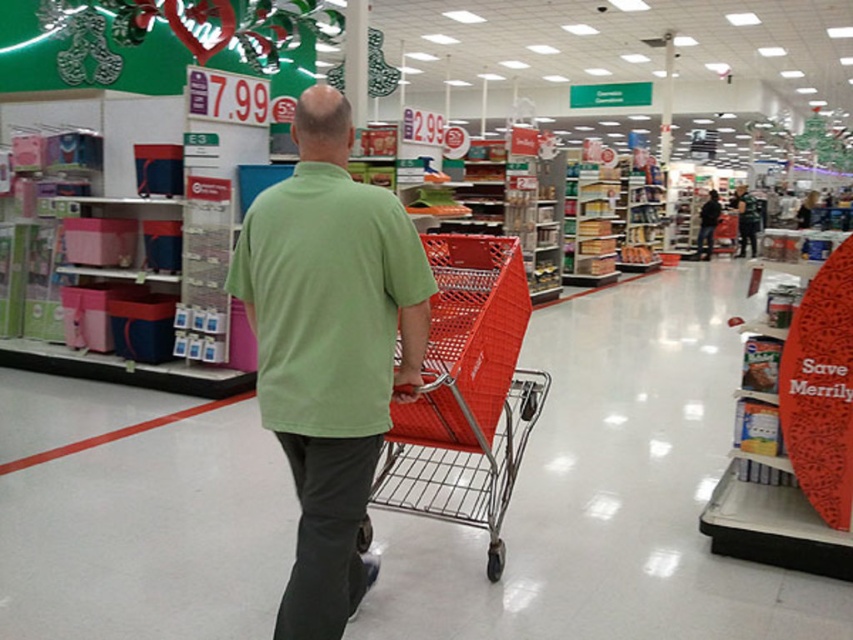
Question: Is green matte shirt at center behind metallic red shopping cart at center?

Choices:
 (A) no
 (B) yes

Answer: (A)

Question: Which object appears closest to the camera in this image?

Choices:
 (A) green matte shirt at center
 (B) metallic red shopping cart at center

Answer: (A)

Question: Does green matte shirt at center appear on the left side of metallic red shopping cart at center?

Choices:
 (A) yes
 (B) no

Answer: (A)

Question: Where is green matte shirt at center located in relation to metallic red shopping cart at center in the image?

Choices:
 (A) above
 (B) below

Answer: (A)

Question: Which point is closer to the camera?

Choices:
 (A) green matte shirt at center
 (B) metallic red shopping cart at center

Answer: (A)

Question: Which point is closer to the camera?

Choices:
 (A) metallic red shopping cart at center
 (B) green matte shirt at center

Answer: (B)